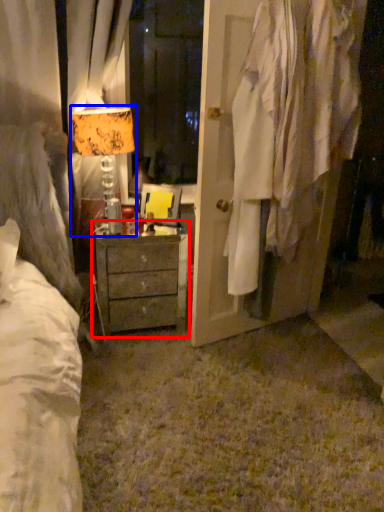
Question: Which object appears farthest to the camera in this image, chest of drawers (highlighted by a red box) or table lamp (highlighted by a blue box)?

Choices:
 (A) chest of drawers
 (B) table lamp

Answer: (A)